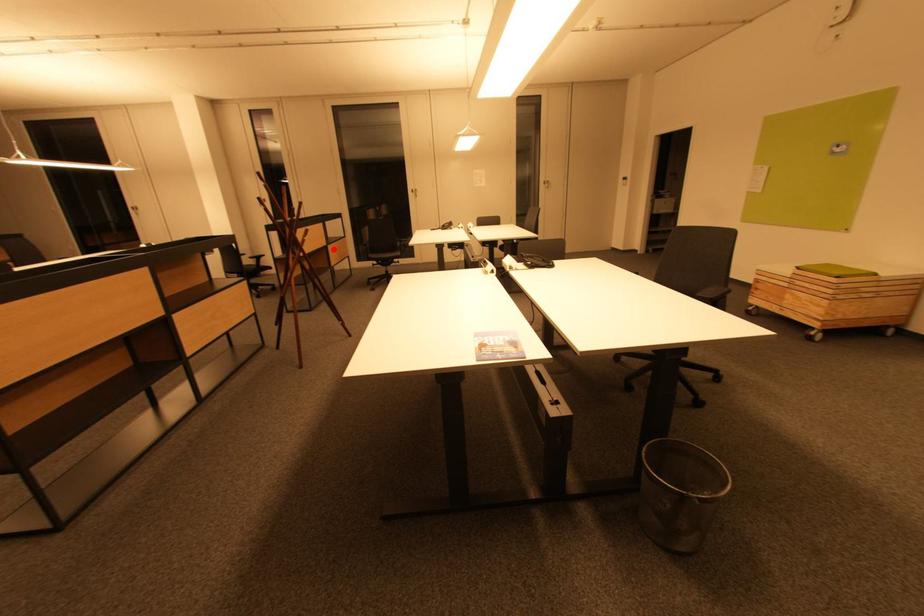
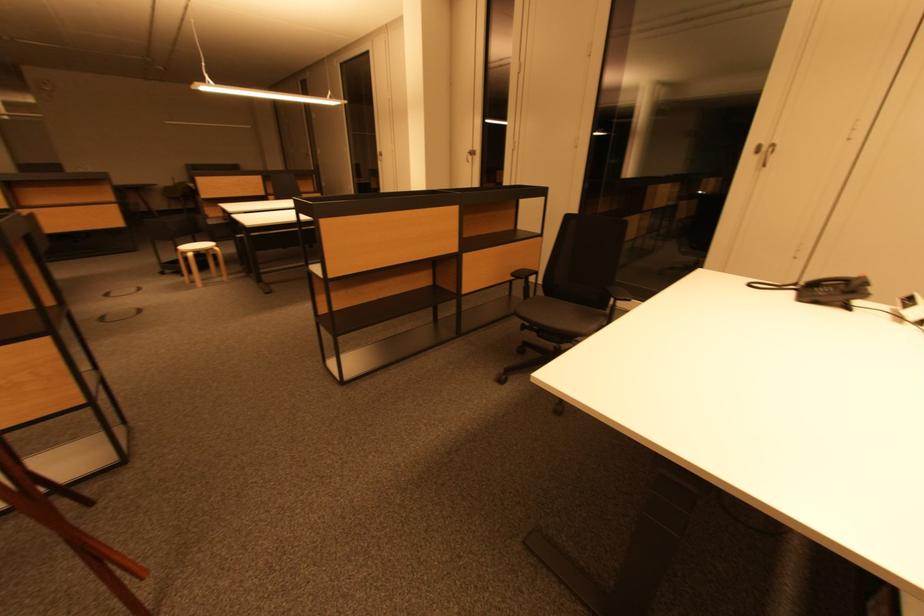
Where in the second image is the point corresponding to the highlighted location from the first image?

(470, 259)